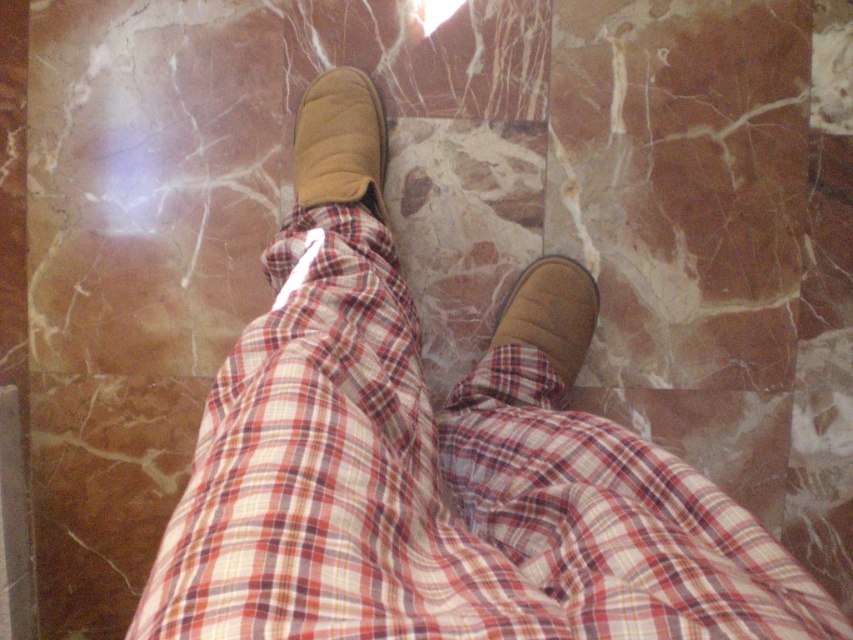
You are a photographer adjusting your camera to focus on two points in the image. The first point is at coordinate point (334, 618) and the second is at point (582, 300). Since you want to focus on the point that is closer to you, which coordinate should you choose?

Point (334, 618) is closer to the viewer than point (582, 300), so you should focus on point (334, 618).

You are a delivery robot navigating through a room. You need to move from the starting point at point (364,184) to the destination point at (582,269). According to the scene, which direction should you move relative to your current position?

Since point (364,184) is in front of point (582,269), you should move backward to reach the destination point (582,269) from your current position at point (364,184).

You are a photographer adjusting your camera to capture the plaid fabric at center and the brown suede slipper at lower right. Which object should you focus on first if you want to ensure both are in focus?

The plaid fabric at center is closer to the viewer than the brown suede slipper at lower right, so you should focus on the plaid fabric at center first to ensure both are in focus.